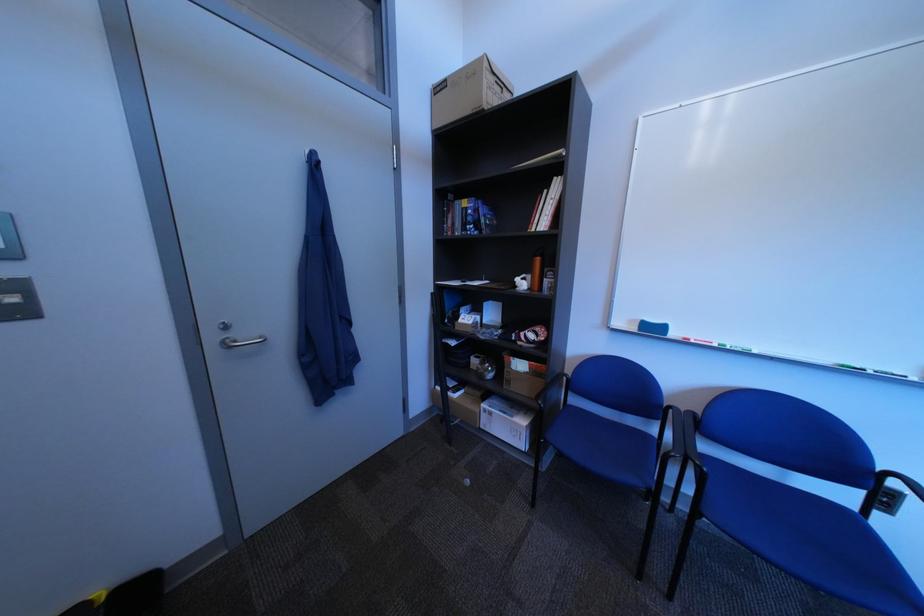
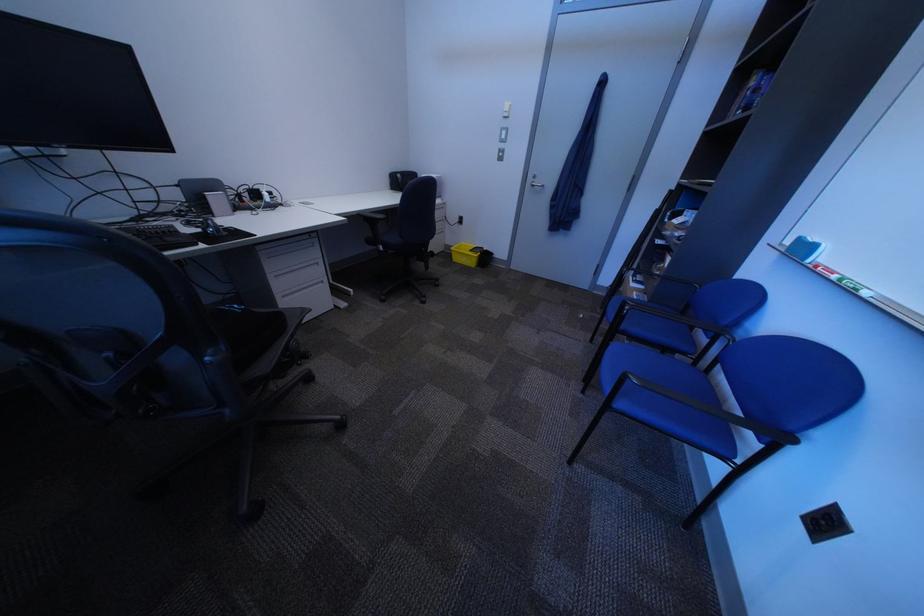
Locate, in the second image, the point that corresponds to (732,347) in the first image.

(849, 278)